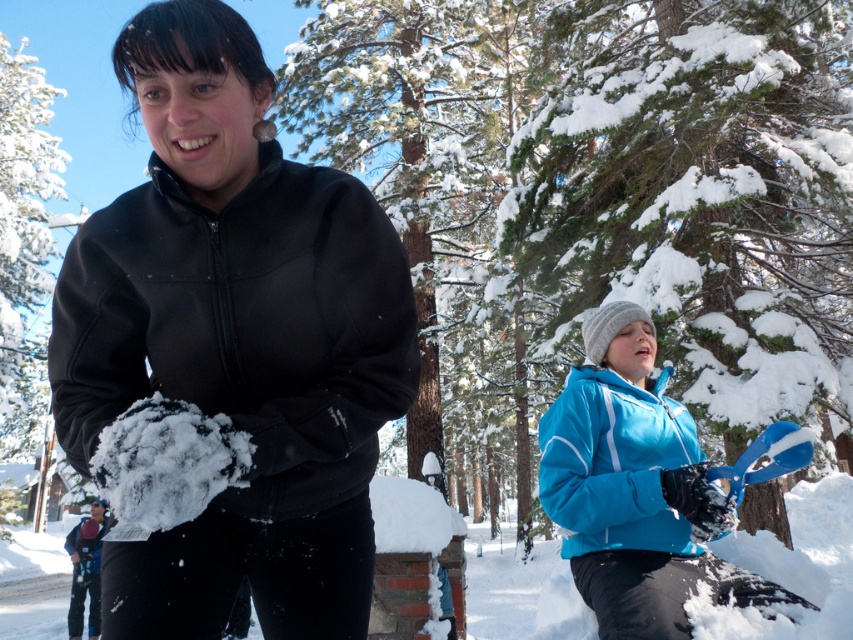
Between point (502, 317) and point (641, 520), which one is positioned behind?

The point (502, 317) is behind.

Can you confirm if green textured pine tree at center is positioned above blue matte jacket at lower right?

No, green textured pine tree at center is not above blue matte jacket at lower right.

Where is `green textured pine tree at center`? The image size is (853, 640). green textured pine tree at center is located at coordinates (596, 195).

Where is `green textured pine tree at center`? The width and height of the screenshot is (853, 640). green textured pine tree at center is located at coordinates (596, 195).

Which is more to the right, green textured pine tree at center or matte black jacket at center?

Positioned to the right is green textured pine tree at center.

Can you confirm if green textured pine tree at center is taller than matte black jacket at center?

Correct, green textured pine tree at center is much taller as matte black jacket at center.

Between point (842, 314) and point (129, 337), which one is positioned behind?

The point (842, 314) is behind.

This screenshot has width=853, height=640. What are the coordinates of `green textured pine tree at center` in the screenshot? It's located at (596, 195).

Between matte black jacket at center and blue matte jacket at lower right, which one has more height?

Standing taller between the two is matte black jacket at center.

Does point (366, 317) lie in front of point (593, 464)?

Yes, it is.

Between point (280, 554) and point (569, 545), which one is positioned behind?

Positioned behind is point (569, 545).

This screenshot has width=853, height=640. In order to click on matte black jacket at center in this screenshot , I will do tap(230, 349).